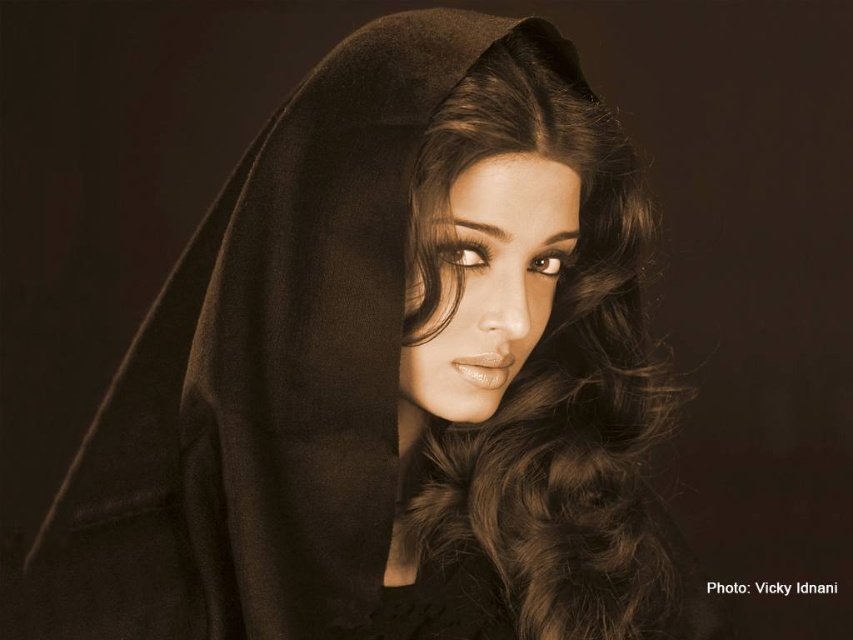
You are a photographer adjusting the lighting for a portrait. You notice the brown silky hair at center and the smooth skin face at center. Which object should you focus the light on to highlight its height?

The brown silky hair at center has a greater height compared to the smooth skin face at center, so you should focus the light on the brown silky hair at center to highlight its height.

You are a photographer adjusting the lighting to ensure the subject is well highlighted. Since the brown silky hair at center and the smooth skin face at center are both in the frame, which one is closer to the camera?

The brown silky hair at center is in front of the smooth skin face at center, so it is closer to the camera.

Based on the photo, you are a photographer adjusting the lighting for a portrait. You notice the brown silky hair at center and the smooth skin face at center. Which object is located to the right of the other?

The brown silky hair at center is positioned on the right side of smooth skin face at center.